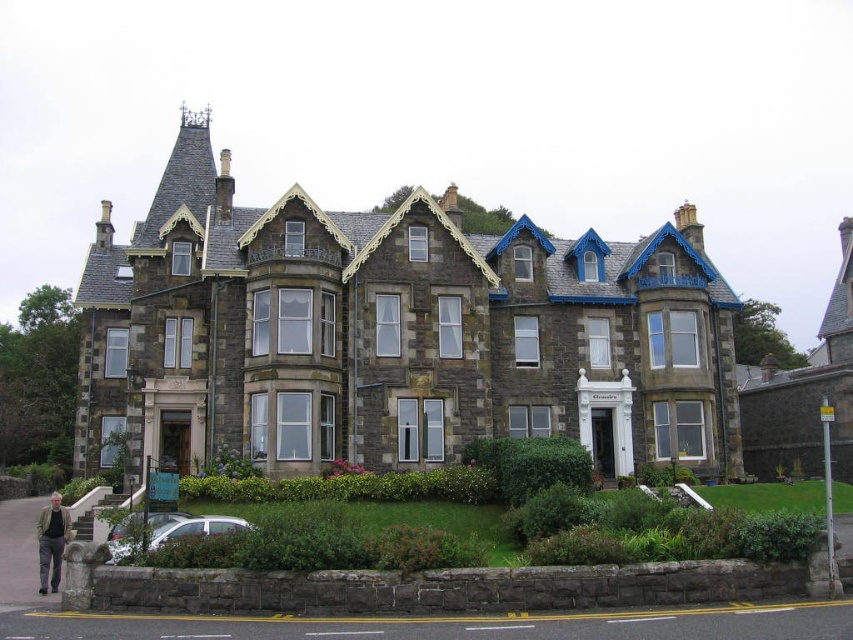
Who is more distant from viewer, (548, 301) or (206, 522)?

Point (548, 301)

Does stone mansion at center have a lesser width compared to silver metallic car at lower left?

No.

You are a GUI agent. You are given a task and a screenshot of the screen. Output one action in this format:
    pyautogui.click(x=<x>, y=<y>)
    Task: Click on the stone mansion at center
    This screenshot has width=853, height=640.
    Given the screenshot: What is the action you would take?
    pyautogui.click(x=392, y=333)

The image size is (853, 640). Find the location of `stone mansion at center`. stone mansion at center is located at coordinates click(x=392, y=333).

Is silver metallic car at lower left to the right of light brown leather jacket at lower left from the viewer's perspective?

Yes, silver metallic car at lower left is to the right of light brown leather jacket at lower left.

Is silver metallic car at lower left positioned behind light brown leather jacket at lower left?

No, it is in front of light brown leather jacket at lower left.

This screenshot has height=640, width=853. What do you see at coordinates (192, 528) in the screenshot?
I see `silver metallic car at lower left` at bounding box center [192, 528].

Where is `silver metallic car at lower left`? silver metallic car at lower left is located at coordinates (192, 528).

Does stone mansion at center have a lesser height compared to dark gray stone mansion at upper right?

Yes, stone mansion at center is shorter than dark gray stone mansion at upper right.

Is point (222, 154) positioned behind point (776, 385)?

No, it is not.

Find the location of a particular element. The image size is (853, 640). stone mansion at center is located at coordinates (392, 333).